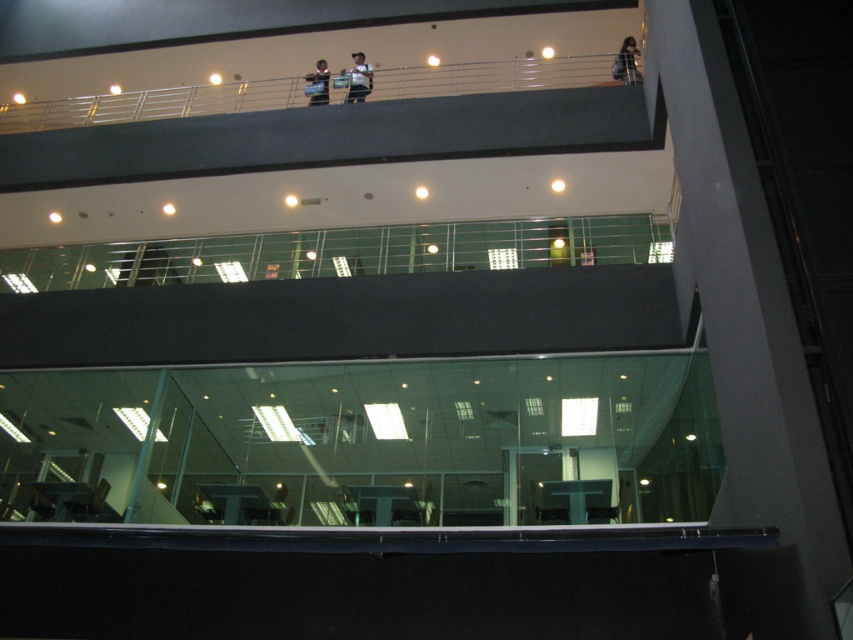
Question: Estimate the real-world distances between objects in this image. Which object is farther from the white matte shirt at upper center?

Choices:
 (A) matte black camera at upper center
 (B) dark hair at upper center

Answer: (B)

Question: Which of the following is the closest to the observer?

Choices:
 (A) (328, 74)
 (B) (352, 83)
 (C) (631, 67)

Answer: (C)

Question: Can you confirm if dark hair at upper center is wider than white matte shirt at upper center?

Choices:
 (A) no
 (B) yes

Answer: (A)

Question: Can you confirm if dark hair at upper center is positioned to the left of white matte shirt at upper center?

Choices:
 (A) yes
 (B) no

Answer: (B)

Question: Does dark hair at upper center have a larger size compared to white matte shirt at upper center?

Choices:
 (A) no
 (B) yes

Answer: (A)

Question: Considering the real-world distances, which object is farthest from the white matte shirt at upper center?

Choices:
 (A) dark hair at upper center
 (B) matte black camera at upper center

Answer: (A)